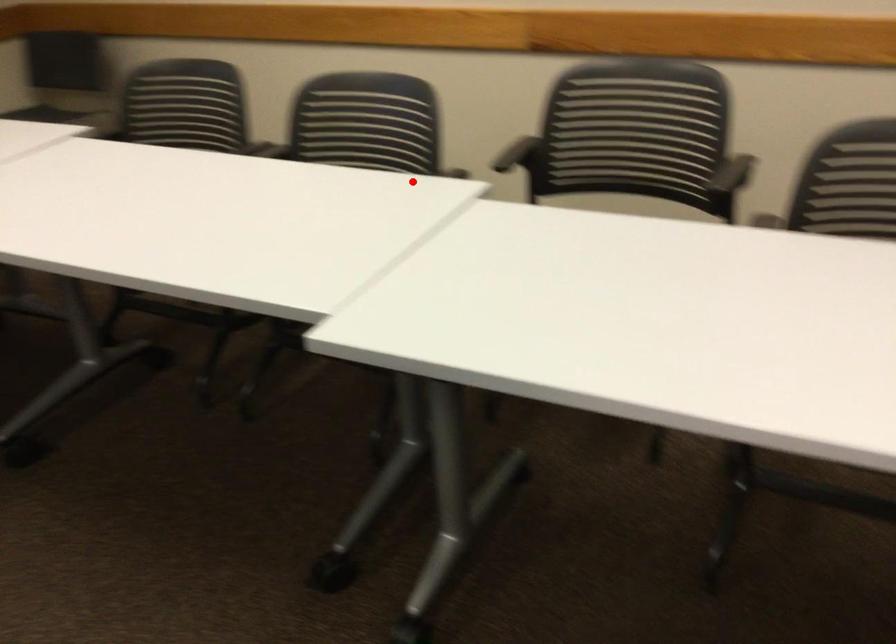
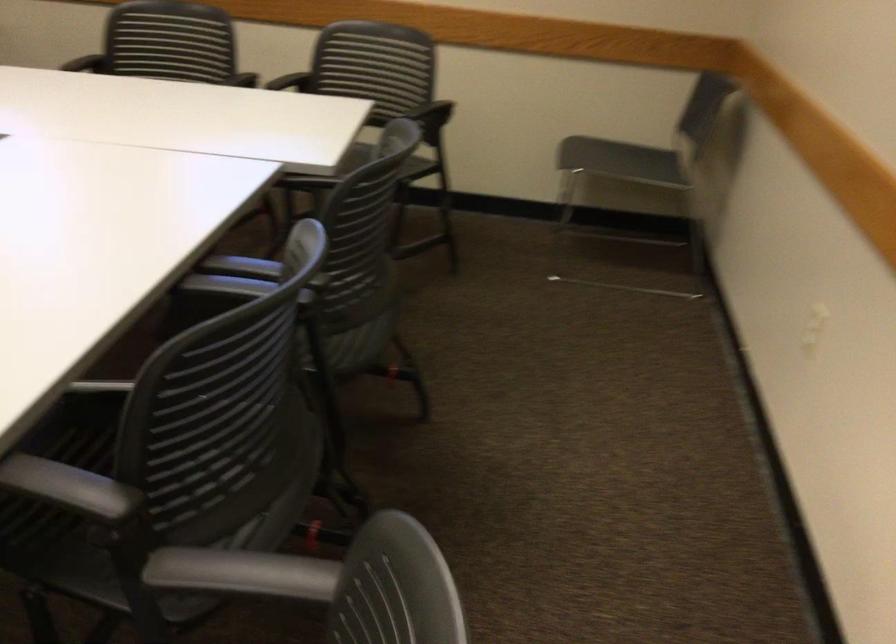
Question: I am providing you with two images of the same scene from different viewpoints. Image1 has a red point marked. In image2, the corresponding 3D location appears at what relative position? Reply with the corresponding letter.

Choices:
 (A) Closer
 (B) Farther

Answer: (A)